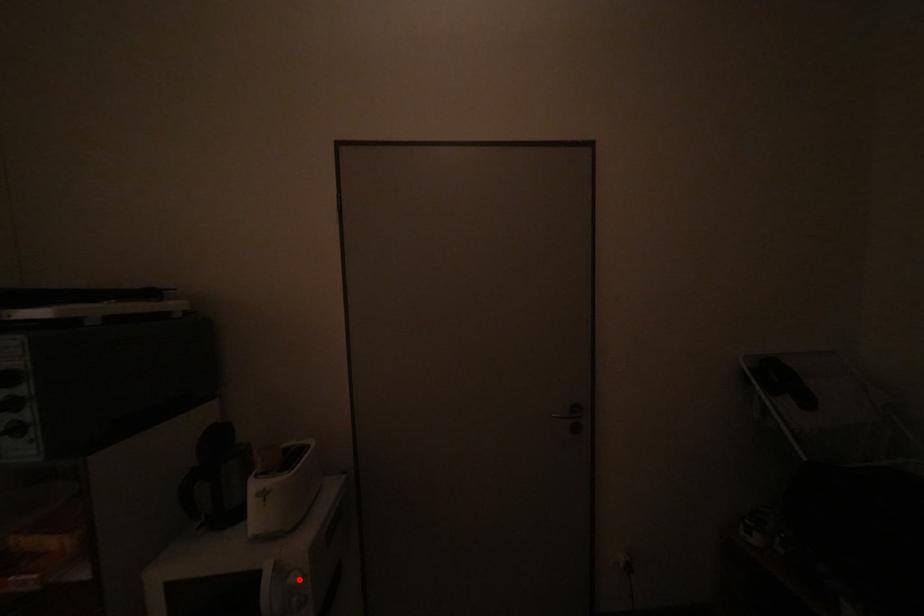
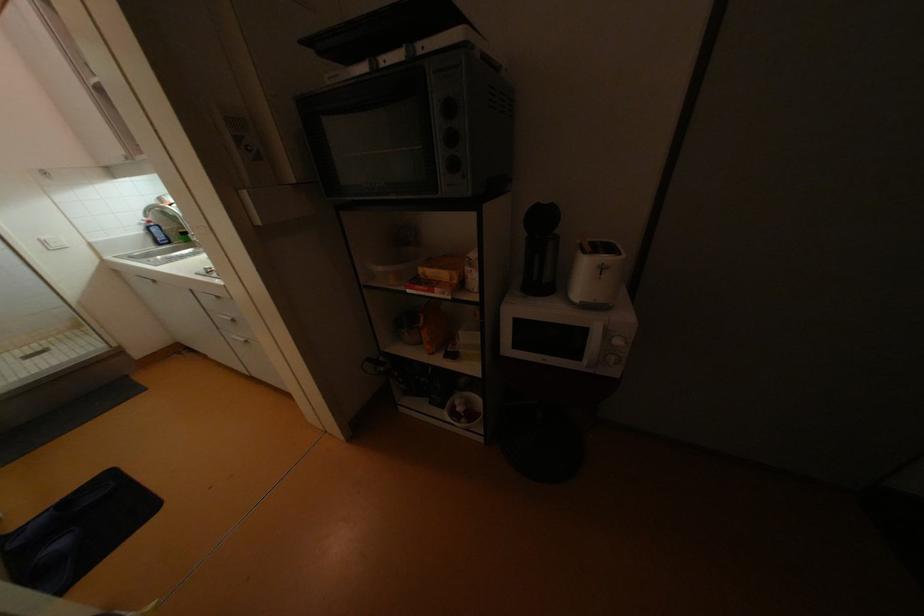
Find the pixel in the second image that matches the highlighted location in the first image.

(623, 342)